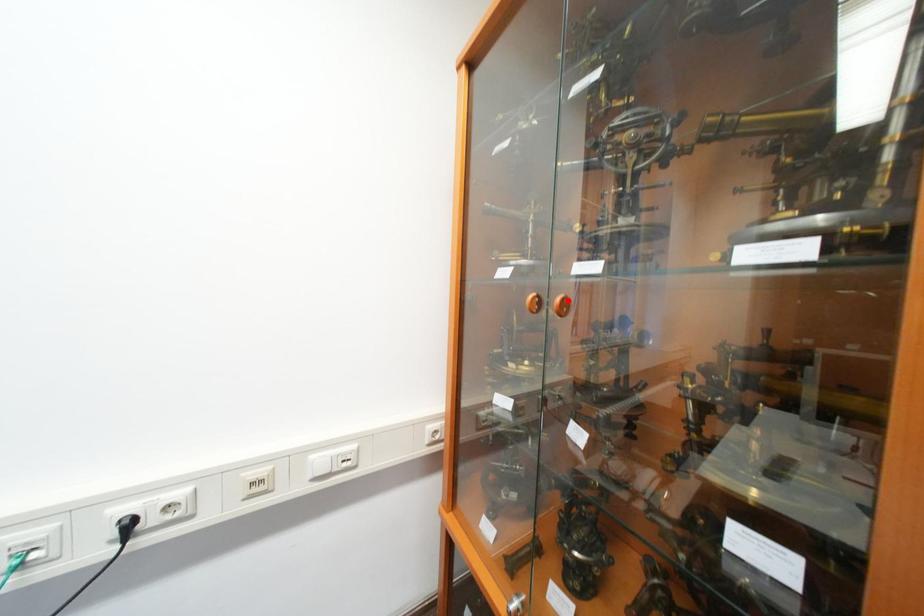
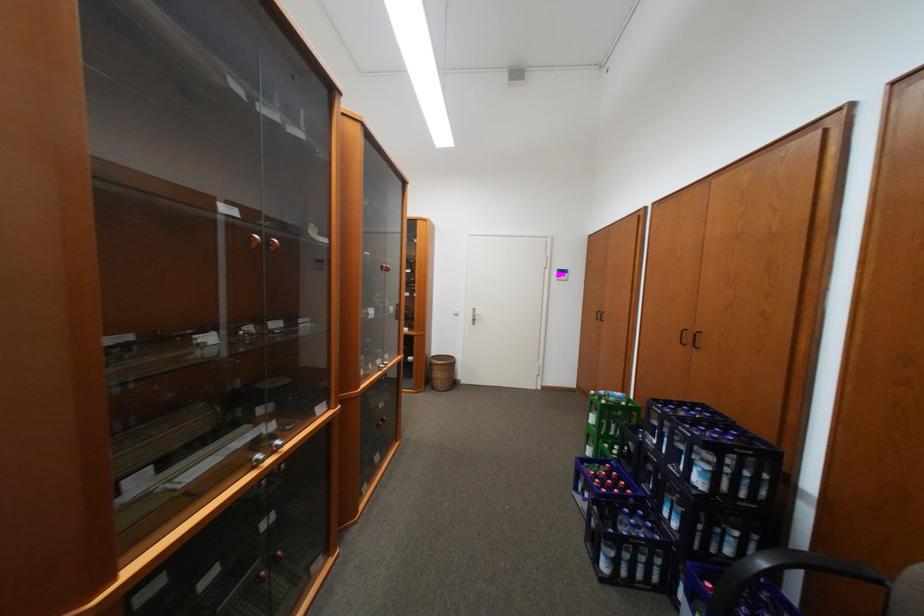
Question: I am providing you with two images of the same scene from different viewpoints. A red point is marked on the first image. At the location where the point appears in image 1, is it still visible in image 2?

Choices:
 (A) Yes
 (B) No

Answer: (B)